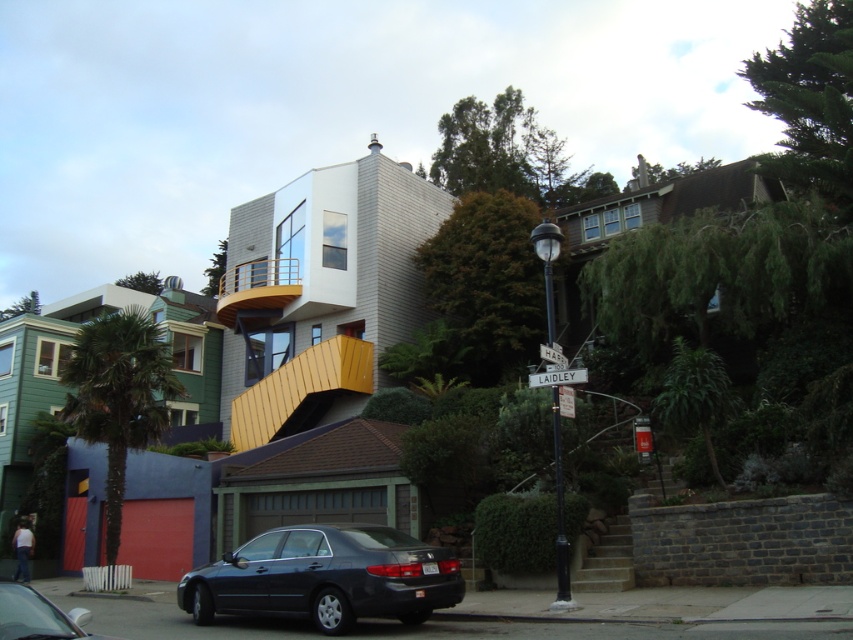
Question: Can you confirm if shiny black sedan at lower left is positioned to the right of white plastic street sign at center?

Choices:
 (A) yes
 (B) no

Answer: (B)

Question: Which of the following is the farthest from the observer?

Choices:
 (A) (550, 256)
 (B) (329, 595)
 (C) (540, 387)

Answer: (A)

Question: Which object appears closest to the camera in this image?

Choices:
 (A) black metal street sign at center
 (B) shiny black sedan at lower left
 (C) matte black sedan at lower center

Answer: (B)

Question: Which of these objects is positioned closest to the shiny black sedan at lower left?

Choices:
 (A) matte black sedan at lower center
 (B) black metal street sign at center

Answer: (A)

Question: Is black metal street sign at center to the left of shiny black sedan at lower left from the viewer's perspective?

Choices:
 (A) no
 (B) yes

Answer: (A)

Question: Is matte black sedan at lower center positioned at the back of white plastic street sign at center?

Choices:
 (A) yes
 (B) no

Answer: (B)